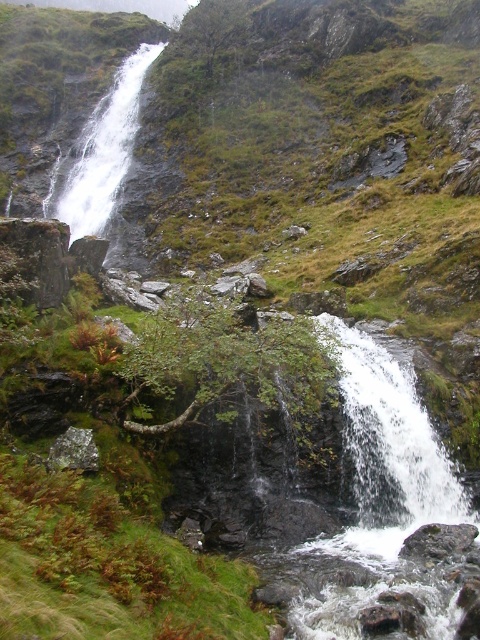
Question: Is gray rough rock at lower right above gray lichen-covered rock at lower left?

Choices:
 (A) no
 (B) yes

Answer: (A)

Question: Observing the image, what is the correct spatial positioning of white frothy water at upper left in reference to gray rough rock at lower right?

Choices:
 (A) below
 (B) above

Answer: (B)

Question: Which object is the farthest from the white frothy water at center?

Choices:
 (A) gray lichen-covered rock at lower left
 (B) gray rough rock at lower right
 (C) white frothy water at upper left

Answer: (C)

Question: Is white frothy water at center thinner than gray rough rock at lower right?

Choices:
 (A) yes
 (B) no

Answer: (A)

Question: Based on their relative distances, which object is nearer to the white frothy water at center?

Choices:
 (A) gray lichen-covered rock at lower left
 (B) white frothy water at upper left

Answer: (A)

Question: Which object is the farthest from the gray lichen-covered rock at lower left?

Choices:
 (A) gray rough rock at lower right
 (B) white frothy water at upper left
 (C) white frothy water at center

Answer: (B)